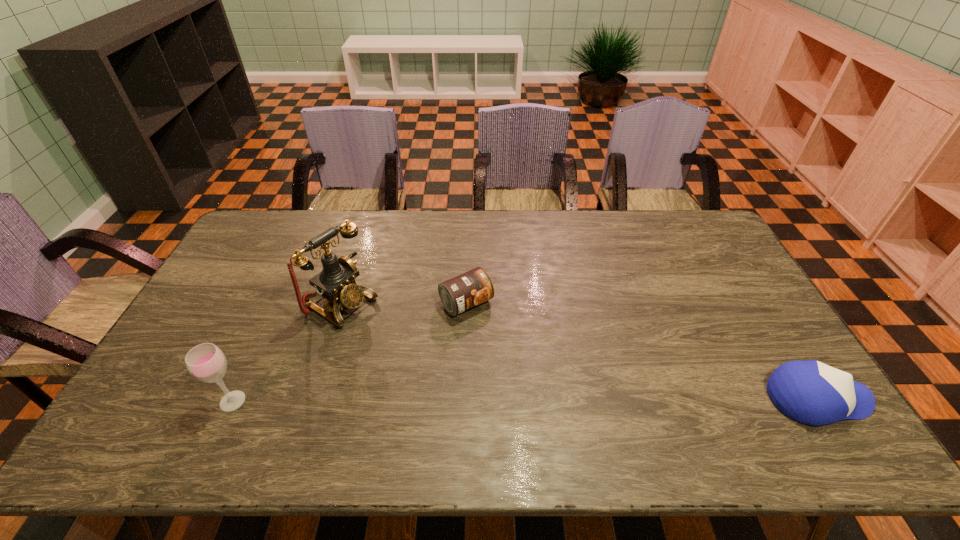
Identify the location of vacant space located on the front of the telephone, featuring the rotary dial. (426, 356).

You are a GUI agent. You are given a task and a screenshot of the screen. Output one action in this format:
    pyautogui.click(x=<x>, y=<y>)
    Task: Click on the vacant region located on the front of the telephone, featuring the rotary dial
    Image resolution: width=960 pixels, height=540 pixels.
    Given the screenshot: What is the action you would take?
    point(395,336)

I want to click on free space located 0.120m on the front of the telephone, featuring the rotary dial, so click(x=397, y=338).

At what (x,y) coordinates should I click in order to perform the action: click on wineglass that is positioned at the near edge. Please return your answer as a coordinate pair (x, y). Looking at the image, I should click on (206, 362).

The image size is (960, 540). What are the coordinates of `baseball cap that is at the near edge` in the screenshot? It's located at [810, 392].

Locate an element on the screen. This screenshot has height=540, width=960. object that is at the right edge is located at coordinates (810, 392).

The image size is (960, 540). What are the coordinates of `object positioned at the near right corner` in the screenshot? It's located at (810, 392).

Locate an element on the screen. vacant space at the far edge of the desktop is located at coordinates (321, 218).

The height and width of the screenshot is (540, 960). Identify the location of vacant space at the near edge. (629, 398).

Image resolution: width=960 pixels, height=540 pixels. In the image, there is a desktop. In order to click on vacant space at the right edge in this screenshot , I will do `click(727, 305)`.